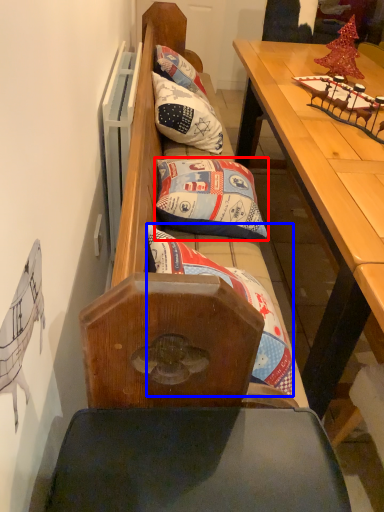
Question: Which object is further to the camera taking this photo, pillow (highlighted by a red box) or pillow (highlighted by a blue box)?

Choices:
 (A) pillow
 (B) pillow

Answer: (A)